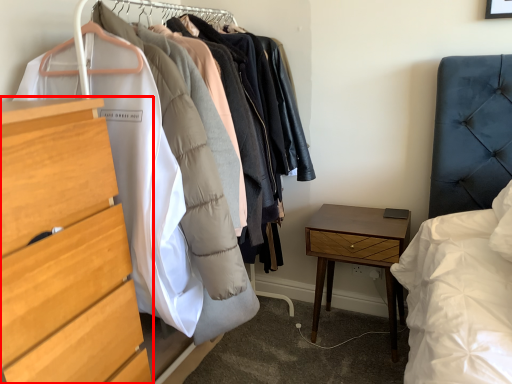
Question: From the image's perspective, where is chest of drawers (annotated by the red box) located in relation to nightstand in the image?

Choices:
 (A) above
 (B) below

Answer: (A)